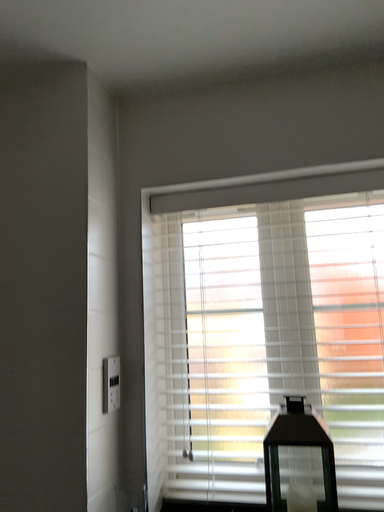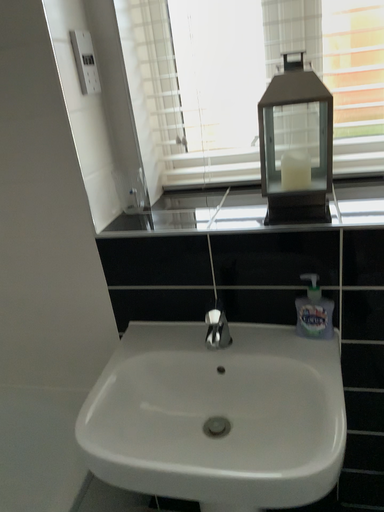
Question: Which way did the camera rotate in the video?

Choices:
 (A) rotated downward
 (B) rotated upward

Answer: (A)